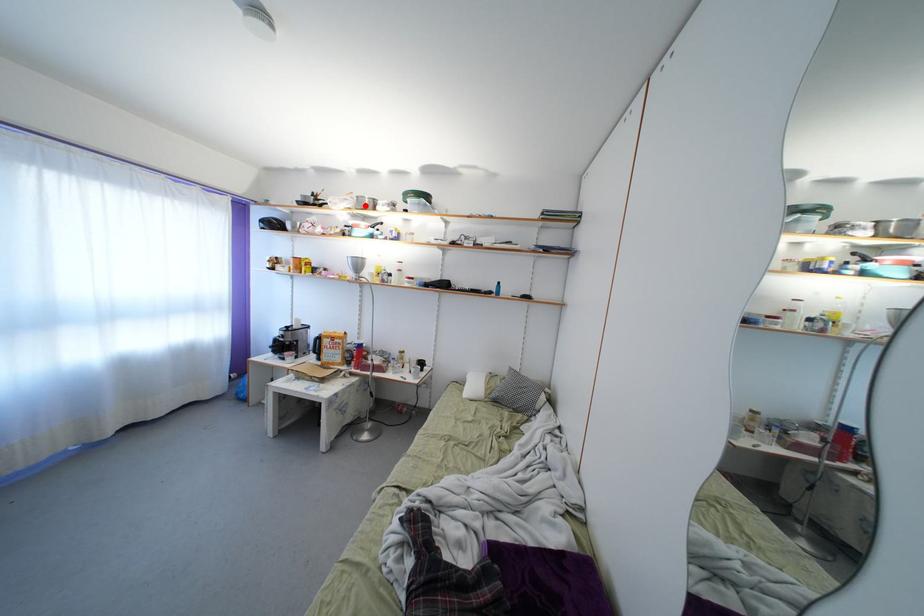
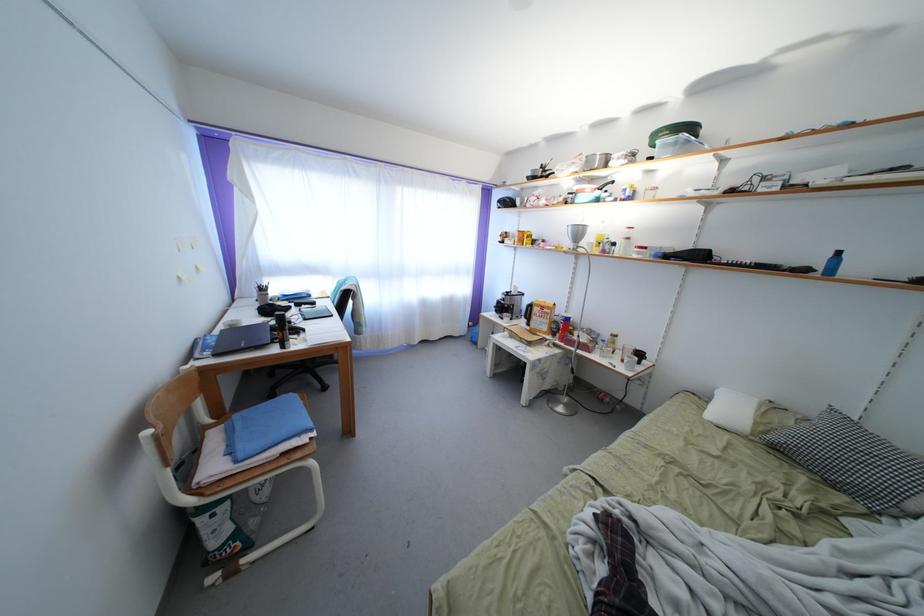
Locate, in the second image, the point that corresponds to the highlighted location in the first image.

(594, 166)